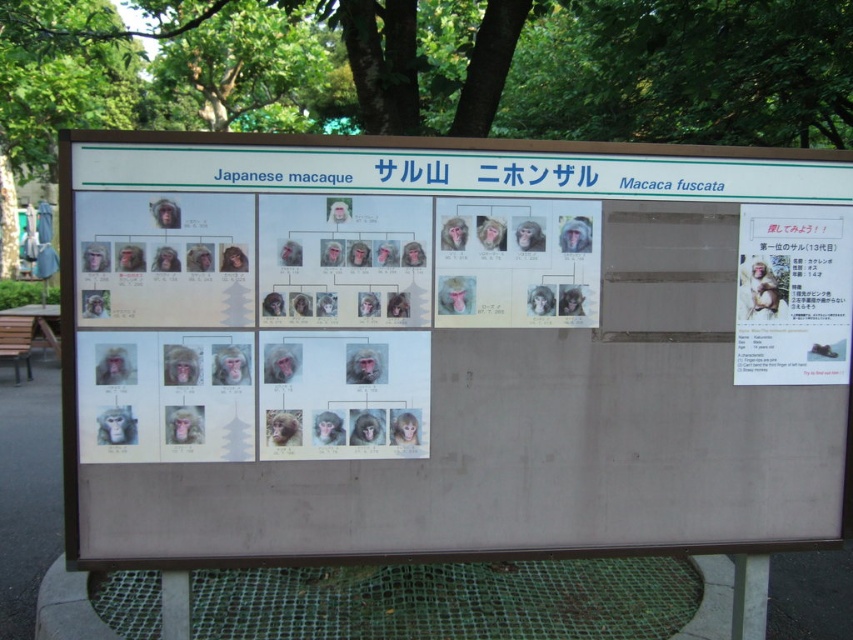
You are a visitor at the park and want to find the white paper at center on the informational board. According to the board layout, where should you look relative to the point marked at coordinates (450, 346)?

The white paper at center is located exactly at the point marked at coordinates (450, 346).

From the picture: You are a visitor at the park and want to read the information about the macaques. Which object should you look at first, the white paper at center or the matte paper poster at upper right?

The white paper at center is larger in size than the matte paper poster at upper right, so you should look at the white paper at center first as it likely contains more detailed information.

What is the exact position of the white paper at center on the board?

The white paper at center is located at point (450, 346).